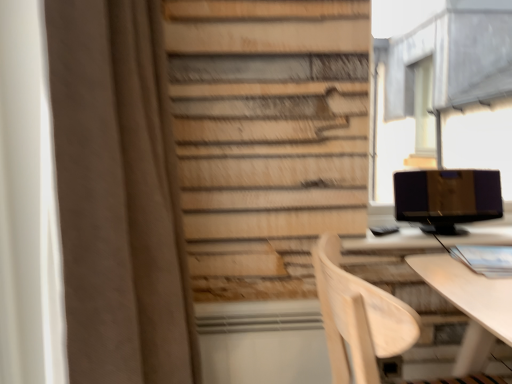
Question: Does metallic gray bay window at upper right contain matte black monitor at right?

Choices:
 (A) no
 (B) yes

Answer: (A)

Question: Is metallic gray bay window at upper right bigger than matte black monitor at right?

Choices:
 (A) no
 (B) yes

Answer: (B)

Question: Is metallic gray bay window at upper right further to the viewer compared to matte black monitor at right?

Choices:
 (A) yes
 (B) no

Answer: (A)

Question: Could you tell me if metallic gray bay window at upper right is turned towards matte black monitor at right?

Choices:
 (A) no
 (B) yes

Answer: (B)

Question: Is metallic gray bay window at upper right placed right next to matte black monitor at right?

Choices:
 (A) no
 (B) yes

Answer: (A)

Question: Visually, is light wood chair at lower right positioned to the left or to the right of matte black monitor at right?

Choices:
 (A) right
 (B) left

Answer: (B)

Question: From the image's perspective, is light wood chair at lower right above or below matte black monitor at right?

Choices:
 (A) above
 (B) below

Answer: (B)

Question: Do you think light wood chair at lower right is within matte black monitor at right, or outside of it?

Choices:
 (A) inside
 (B) outside

Answer: (B)

Question: Considering the positions of point (357, 365) and point (432, 221), is point (357, 365) closer or farther from the camera than point (432, 221)?

Choices:
 (A) closer
 (B) farther

Answer: (A)

Question: Visually, is brown fabric curtain at left positioned to the left or to the right of matte black monitor at right?

Choices:
 (A) right
 (B) left

Answer: (B)

Question: From the image's perspective, is brown fabric curtain at left positioned above or below matte black monitor at right?

Choices:
 (A) below
 (B) above

Answer: (A)

Question: Looking at the image, does brown fabric curtain at left seem bigger or smaller compared to matte black monitor at right?

Choices:
 (A) big
 (B) small

Answer: (A)

Question: From a real-world perspective, relative to matte black monitor at right, is brown fabric curtain at left vertically above or below?

Choices:
 (A) below
 (B) above

Answer: (B)

Question: Considering the relative positions of brown fabric curtain at left and light wood chair at lower right in the image provided, is brown fabric curtain at left to the left or to the right of light wood chair at lower right?

Choices:
 (A) left
 (B) right

Answer: (A)

Question: Looking at their shapes, would you say brown fabric curtain at left is wider or thinner than light wood chair at lower right?

Choices:
 (A) thin
 (B) wide

Answer: (A)